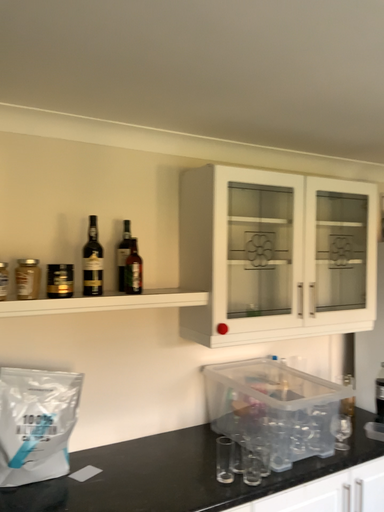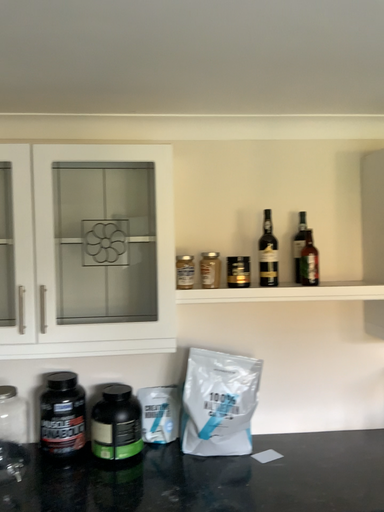
Question: Which way did the camera rotate in the video?

Choices:
 (A) rotated right
 (B) rotated left

Answer: (B)